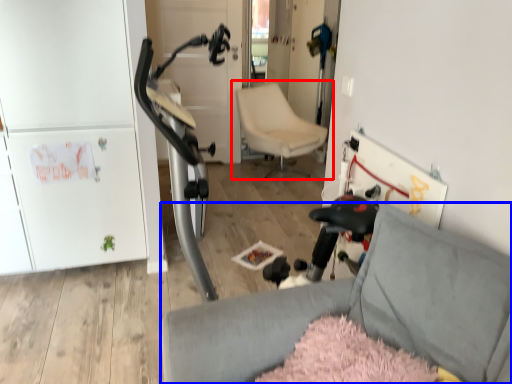
Question: Which object appears farthest to the camera in this image, chair (highlighted by a red box) or chair (highlighted by a blue box)?

Choices:
 (A) chair
 (B) chair

Answer: (A)